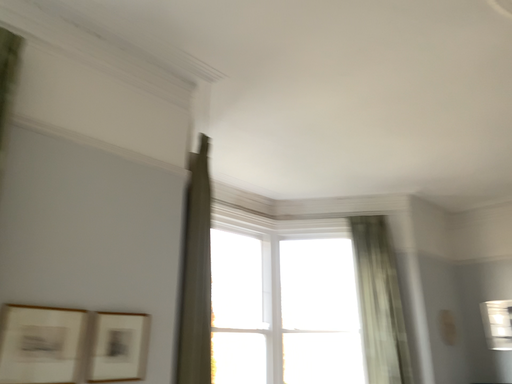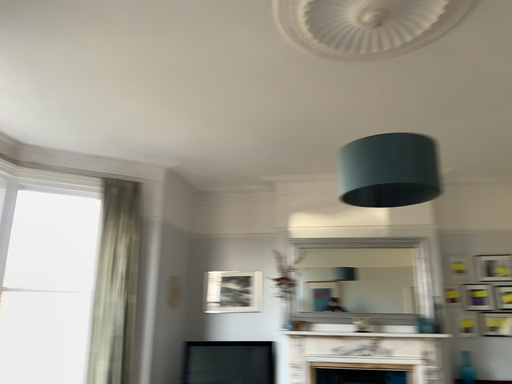
Question: How did the camera likely rotate when shooting the video?

Choices:
 (A) rotated upward
 (B) rotated downward

Answer: (B)